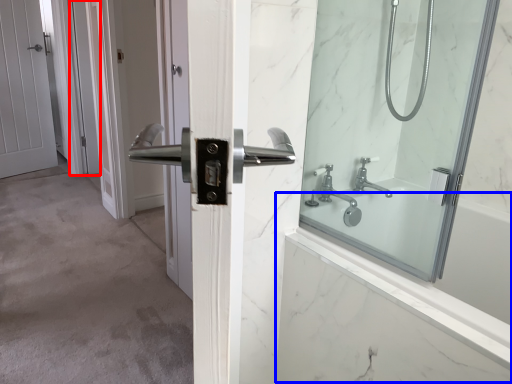
Question: Which point is further to the camera, screen door (highlighted by a red box) or bath (highlighted by a blue box)?

Choices:
 (A) screen door
 (B) bath

Answer: (A)